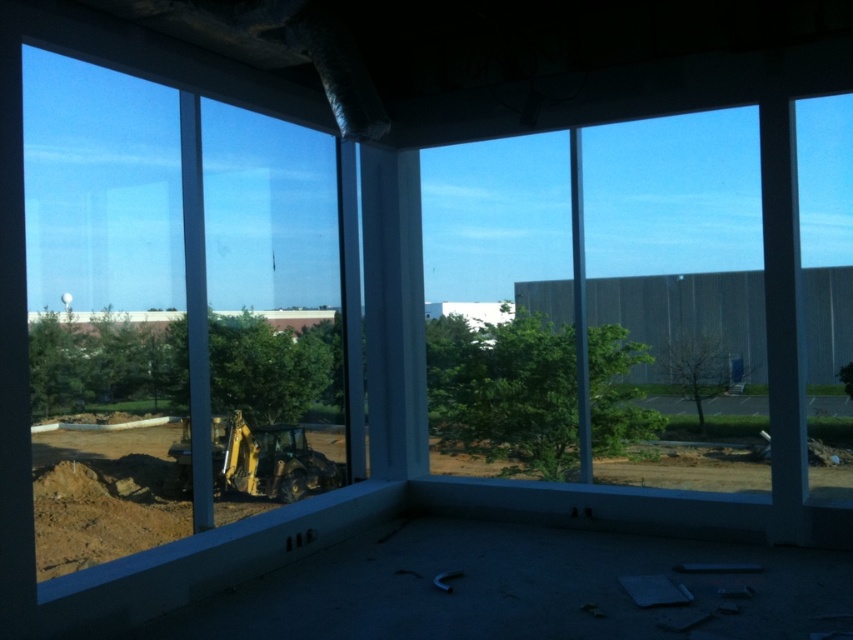
From the picture: Who is positioned more to the left, transparent glass window at center or yellow rubber excavator at lower left?

yellow rubber excavator at lower left is more to the left.

Which is in front, point (740, 352) or point (218, 445)?

Point (218, 445) is more forward.

Identify the location of transparent glass window at center. Image resolution: width=853 pixels, height=640 pixels. (676, 296).

Can you confirm if clear glass window at left is wider than yellow rubber excavator at lower left?

Correct, the width of clear glass window at left exceeds that of yellow rubber excavator at lower left.

Can you confirm if clear glass window at left is shorter than yellow rubber excavator at lower left?

In fact, clear glass window at left may be taller than yellow rubber excavator at lower left.

At what (x,y) coordinates should I click in order to perform the action: click on clear glass window at left. Please return your answer as a coordinate pair (x, y). The image size is (853, 640). Looking at the image, I should click on (172, 310).

Does clear glass window at left appear over transparent glass window at center?

Yes.

Can you confirm if clear glass window at left is positioned below transparent glass window at center?

No, clear glass window at left is not below transparent glass window at center.

Does point (318, 196) come closer to viewer compared to point (614, 438)?

No, it is not.

Locate an element on the screen. This screenshot has width=853, height=640. clear glass window at left is located at coordinates (172, 310).